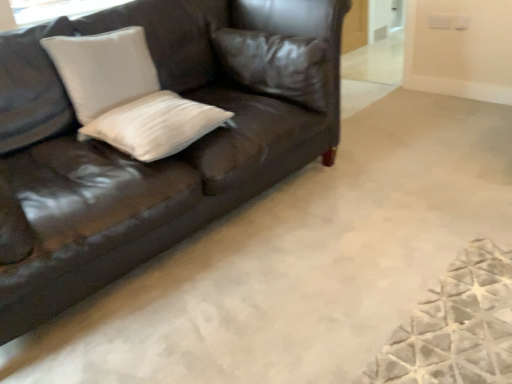
Question: In terms of height, does white matte pillow at center, the second pillow positioned from the right, look taller or shorter compared to white matte pillow at upper left, which is counted as the 1th pillow, starting from the left?

Choices:
 (A) short
 (B) tall

Answer: (A)

Question: In terms of width, does white matte pillow at center, arranged as the 2th pillow when viewed from the left, look wider or thinner when compared to white matte pillow at upper left, which appears as the 3th pillow when viewed from the right?

Choices:
 (A) thin
 (B) wide

Answer: (B)

Question: Considering the real-world distances, which object is closest to the shiny brown leather couch at upper left?

Choices:
 (A) white matte pillow at upper left, which appears as the 3th pillow when viewed from the right
 (B) leather pillow at upper center, which is the third pillow in left-to-right order
 (C) white matte pillow at center, the second pillow positioned from the right

Answer: (C)

Question: Considering the real-world distances, which object is farthest from the leather pillow at upper center, which is the third pillow in left-to-right order?

Choices:
 (A) shiny brown leather couch at upper left
 (B) white matte pillow at center, arranged as the 2th pillow when viewed from the left
 (C) white matte pillow at upper left, which is counted as the 1th pillow, starting from the left

Answer: (C)